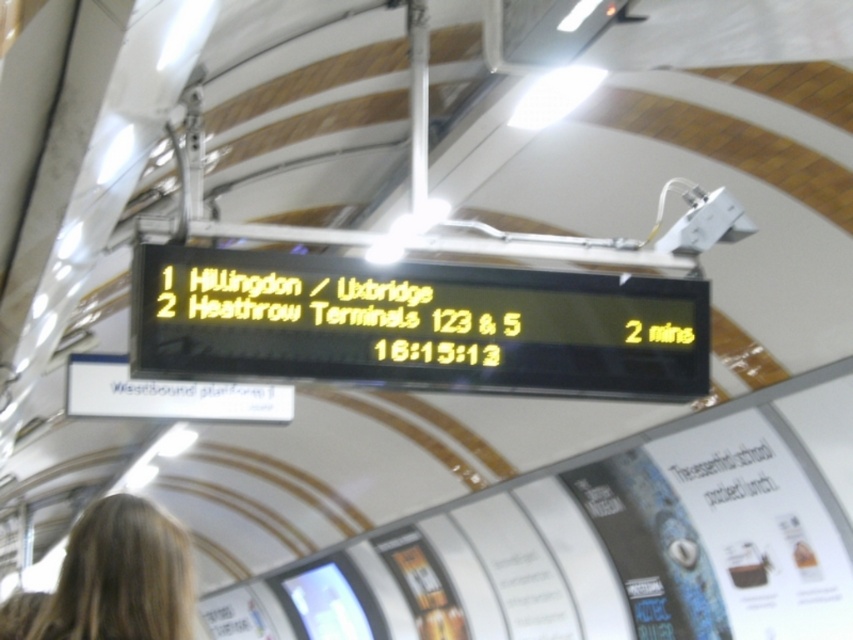
Question: Which object appears farthest from the camera in this image?

Choices:
 (A) blonde hair at lower left
 (B) yellow led display at center

Answer: (B)

Question: Does yellow led display at center have a greater width compared to blonde hair at lower left?

Choices:
 (A) no
 (B) yes

Answer: (B)

Question: Which point is closer to the camera?

Choices:
 (A) blonde hair at lower left
 (B) yellow led display at center

Answer: (A)

Question: Can you confirm if yellow led display at center is wider than blonde hair at lower left?

Choices:
 (A) yes
 (B) no

Answer: (A)

Question: Does yellow led display at center have a lesser width compared to blonde hair at lower left?

Choices:
 (A) no
 (B) yes

Answer: (A)